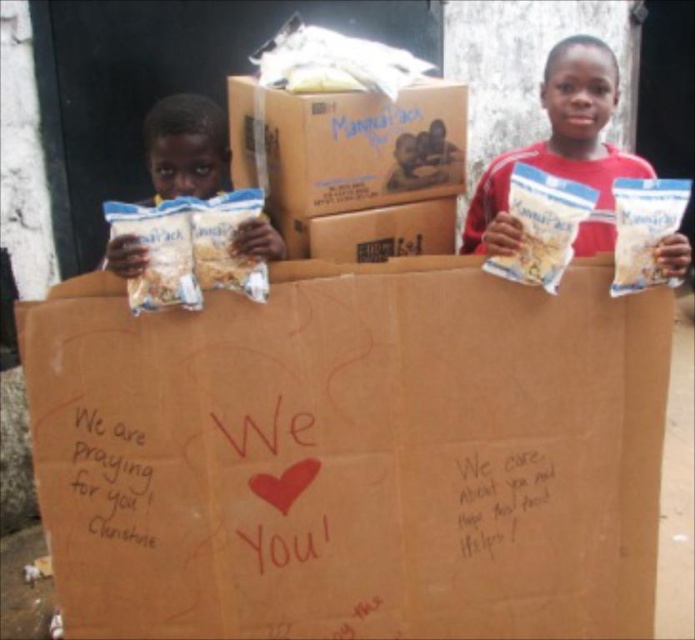
Between brown cardboard box at center and white matte bag at center, which one has less height?

brown cardboard box at center is shorter.

Can you confirm if brown cardboard box at center is taller than white matte bag at center?

In fact, brown cardboard box at center may be shorter than white matte bag at center.

Is point (432, 93) closer to camera compared to point (506, 200)?

Yes.

Find the location of a particular element. The image size is (695, 640). brown cardboard box at center is located at coordinates (359, 152).

Is brown cardboard box at center shorter than white matte bag at left?

No, brown cardboard box at center is not shorter than white matte bag at left.

You are a GUI agent. You are given a task and a screenshot of the screen. Output one action in this format:
    pyautogui.click(x=<x>, y=<y>)
    Task: Click on the brown cardboard box at center
    
    Given the screenshot: What is the action you would take?
    pyautogui.click(x=359, y=152)

In the scene shown: Does brown cardboard at center have a lesser width compared to white matte bag at left?

No.

In the scene shown: Can you confirm if brown cardboard at center is positioned to the right of white matte bag at left?

Indeed, brown cardboard at center is positioned on the right side of white matte bag at left.

Who is more forward, (352, 636) or (204, 176)?

Point (352, 636) is in front.

Where is `brown cardboard at center`? brown cardboard at center is located at coordinates (352, 454).